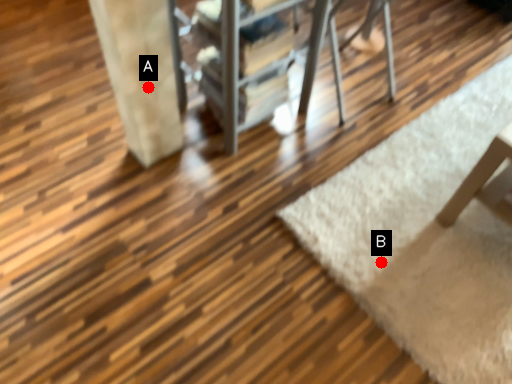
Question: Two points are circled on the image, labeled by A and B beside each circle. Which point is farther to the camera?

Choices:
 (A) A is further
 (B) B is further

Answer: (B)